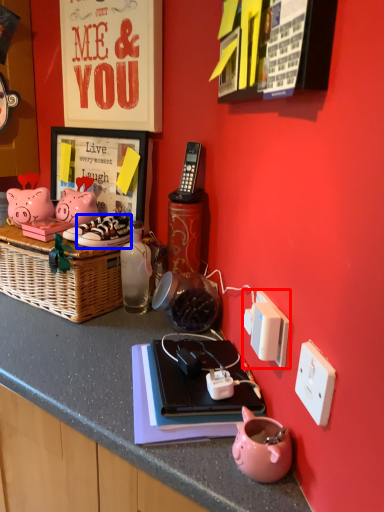
Question: Which object is further to the camera taking this photo, power plugs and sockets (highlighted by a red box) or footwear (highlighted by a blue box)?

Choices:
 (A) power plugs and sockets
 (B) footwear

Answer: (B)